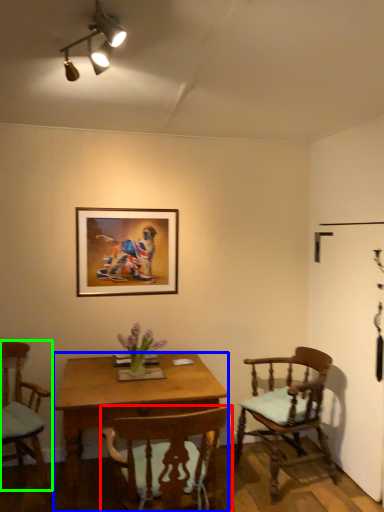
Question: Estimate the real-world distances between objects in this image. Which object is farther from chair (highlighted by a red box), desk (highlighted by a blue box) or chair (highlighted by a green box)?

Choices:
 (A) desk
 (B) chair

Answer: (B)